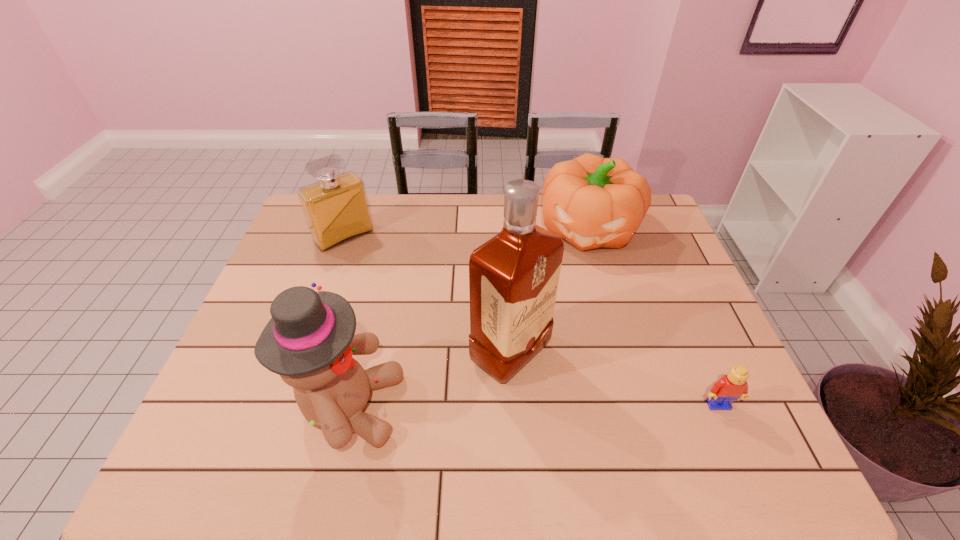
The image size is (960, 540). I want to click on vacant space on the desktop that is between the fourth shortest object and the shortest object and is positioned on the carved face of the pumpkin, so 540,406.

Identify the location of free spot on the desktop that is between the rag_doll and the shortest object and is positioned on the front-facing side of the perfume. (492, 406).

This screenshot has height=540, width=960. In order to click on vacant spot on the desktop that is between the rag_doll and the Lego and is positioned on the front label of the tallest object in this screenshot , I will do `click(579, 406)`.